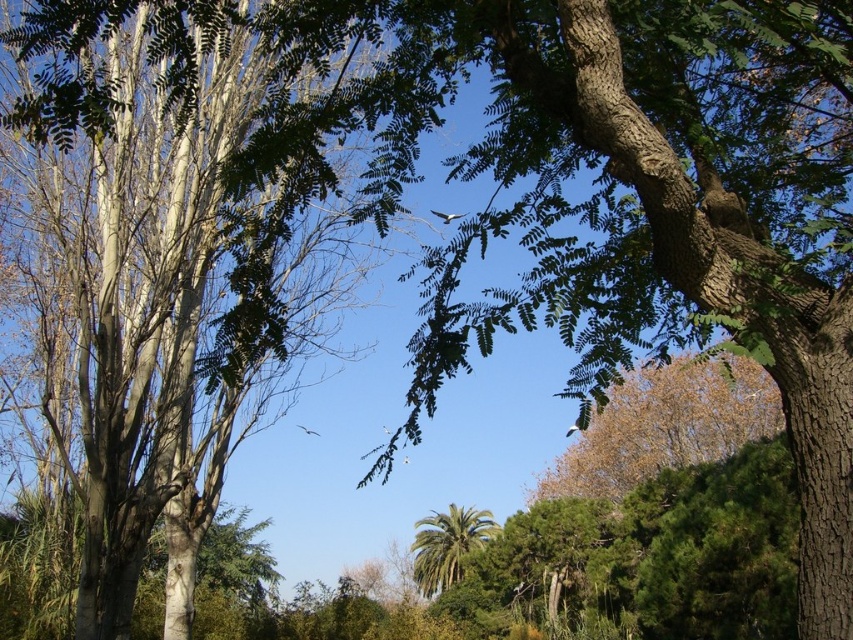
Question: Is green leafy tree at center below green leafy palm at center?

Choices:
 (A) no
 (B) yes

Answer: (A)

Question: Does brown leafy tree at upper center appear on the right side of green leafy palm at center?

Choices:
 (A) yes
 (B) no

Answer: (A)

Question: Can you confirm if green leafy tree at center is positioned to the left of green leafy palm at center?

Choices:
 (A) yes
 (B) no

Answer: (A)

Question: Which object appears farthest from the camera in this image?

Choices:
 (A) brown leafy tree at upper center
 (B) green leafy palm at center
 (C) green leafy tree at center

Answer: (B)

Question: Which point appears farthest from the camera in this image?

Choices:
 (A) (437, 582)
 (B) (637, 394)
 (C) (144, 8)

Answer: (A)

Question: Which is nearer to the green leafy tree at center?

Choices:
 (A) green leafy palm at center
 (B) brown leafy tree at upper center

Answer: (B)